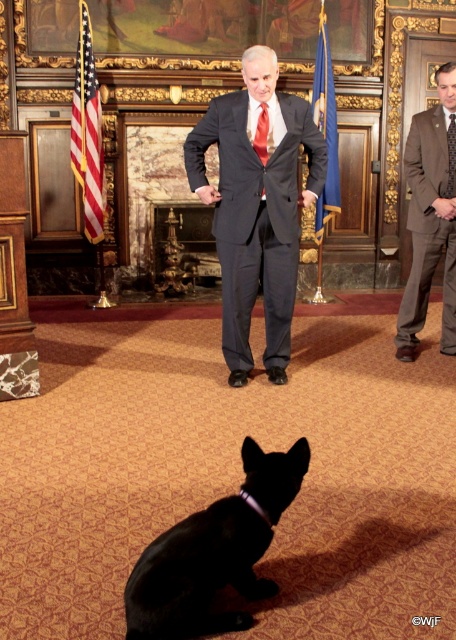
You are a photographer setting up for an event in this room. You need to position a camera stand that must be placed behind both the matte gray suit at center and the black textured tie at right to capture them in the frame. Given their heights, which object should the camera stand be positioned closer to in order to ensure both are fully visible?

The matte gray suit at center is taller than the black textured tie at right. To ensure both are fully visible, the camera stand should be positioned closer to the black textured tie at right so the camera can angle upwards to capture the taller matte gray suit at center without cropping either subject.